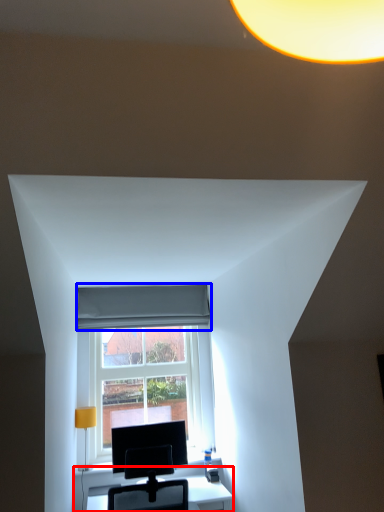
Question: Which of the following is the farthest to the observer, table (highlighted by a red box) or curtain (highlighted by a blue box)?

Choices:
 (A) table
 (B) curtain

Answer: (B)